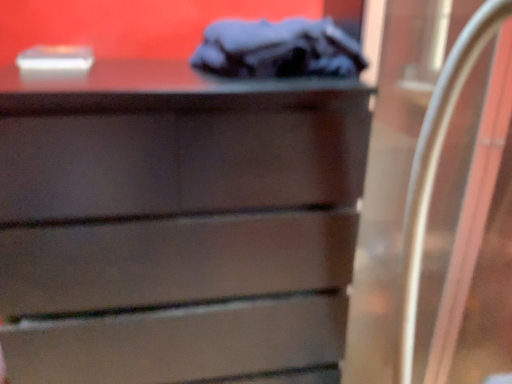
Question: Which is correct: dark gray fabric at upper center is inside clear glass door at right, or outside of it?

Choices:
 (A) outside
 (B) inside

Answer: (A)

Question: From a real-world perspective, is dark gray fabric at upper center positioned above or below clear glass door at right?

Choices:
 (A) above
 (B) below

Answer: (A)

Question: Which of these objects is positioned farthest from the clear glass door at right?

Choices:
 (A) matte brown chest of drawers at center
 (B) dark gray fabric at upper center

Answer: (A)

Question: Which object is positioned closest to the clear glass door at right?

Choices:
 (A) matte brown chest of drawers at center
 (B) dark gray fabric at upper center

Answer: (B)